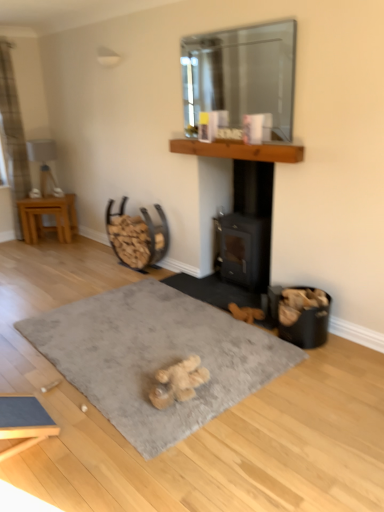
Question: Is metallic brown firewood rack at center-left spatially inside plaid fabric curtain at left, or outside of it?

Choices:
 (A) outside
 (B) inside

Answer: (A)

Question: Is point click(119, 247) positioned closer to the camera than point click(16, 144)?

Choices:
 (A) farther
 (B) closer

Answer: (B)

Question: Which object is positioned closest to the brown wooden mantle at upper center?

Choices:
 (A) black matte wood burning stove at center
 (B) fuzzy beige teddy bear at center
 (C) transparent glass mirror at upper center
 (D) gray soft rug at center
 (E) metallic brown firewood rack at center-left

Answer: (A)

Question: Which object is the closest to the brown wooden mantle at upper center?

Choices:
 (A) fuzzy beige teddy bear at center
 (B) plaid fabric curtain at left
 (C) light brown wooden table at left
 (D) transparent glass mirror at upper center
 (E) gray soft rug at center

Answer: (D)